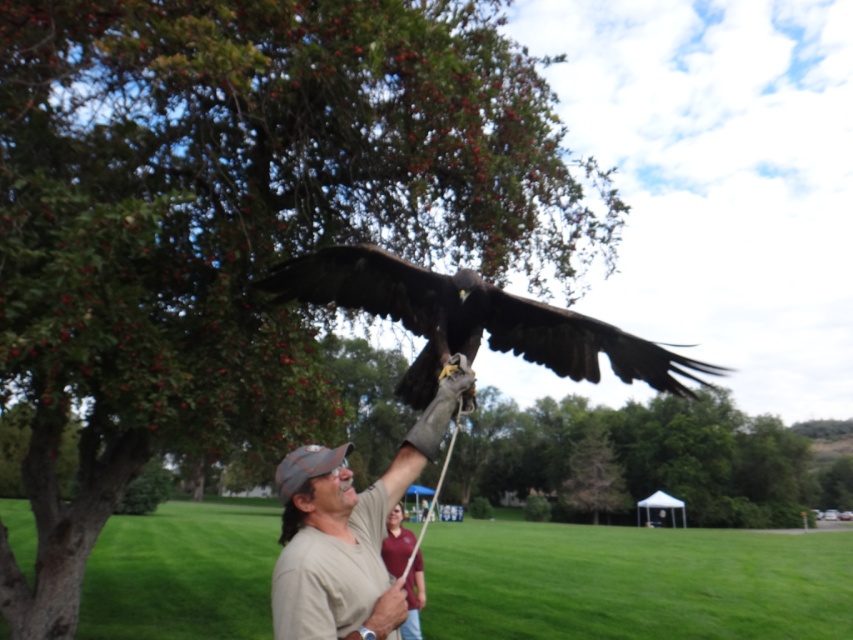
Question: Which of the following is the farthest from the observer?

Choices:
 (A) green leafy tree at upper left
 (B) dark brown feathers at center
 (C) leather glove at center
 (D) tan cotton shirt at center

Answer: (A)

Question: Which point is farther to the camera?

Choices:
 (A) (384, 616)
 (B) (318, 557)
 (C) (401, 513)

Answer: (C)

Question: Is dark brown feathers at center thinner than tan cotton shirt at center?

Choices:
 (A) yes
 (B) no

Answer: (B)

Question: Which object appears closest to the camera in this image?

Choices:
 (A) leather glove at center
 (B) green leafy tree at upper left
 (C) tan cotton shirt at center
 (D) dark brown feathers at center

Answer: (C)

Question: Considering the relative positions of tan cotton shirt at center and beige cotton shirt at center in the image provided, where is tan cotton shirt at center located with respect to beige cotton shirt at center?

Choices:
 (A) above
 (B) below

Answer: (A)

Question: Does tan cotton shirt at center appear on the left side of leather glove at center?

Choices:
 (A) yes
 (B) no

Answer: (A)